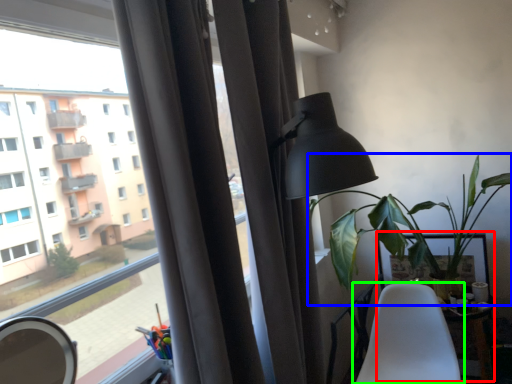
Question: Which object is positioned farthest from table (highlighted by a red box)? Select from houseplant (highlighted by a blue box) and chair (highlighted by a green box).

Choices:
 (A) houseplant
 (B) chair

Answer: (A)